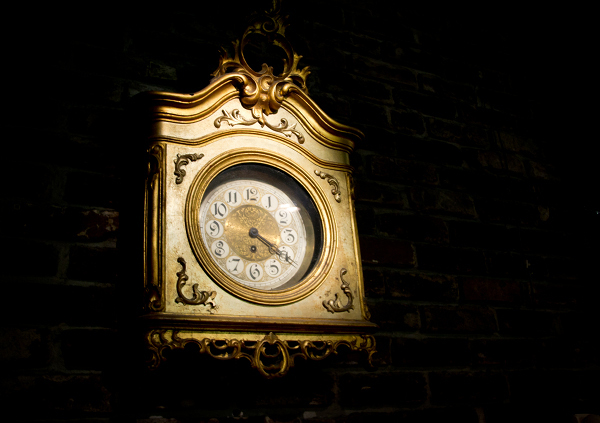
At what (x,y) coordinates should I click in order to perform the action: click on space below wall clock. Please return your answer as a coordinate pair (x, y). This screenshot has height=423, width=600. Looking at the image, I should click on (265, 382).